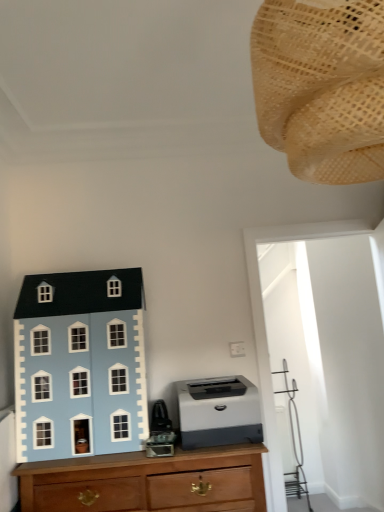
Find the location of `light blue matte dollhouse at left, marked as the 2th toy in a front-to-back arrangement`. light blue matte dollhouse at left, marked as the 2th toy in a front-to-back arrangement is located at coordinates (80, 365).

What is the approximate height of wooden chest of drawers at lower left?

It is 19.79 inches.

Locate an element on the screen. gray matte printer at center is located at coordinates (218, 412).

From a real-world perspective, between woven beige lampshade at upper right, acting as the second toy starting from the left, and gray matte printer at center, who is vertically higher?

In real-world perspective, woven beige lampshade at upper right, acting as the second toy starting from the left, is above.

What's the angular difference between woven beige lampshade at upper right, the second toy positioned from the back, and gray matte printer at center's facing directions?

The angle between the facing direction of woven beige lampshade at upper right, the second toy positioned from the back, and the facing direction of gray matte printer at center is 178 degrees.

Which is correct: woven beige lampshade at upper right, the second toy positioned from the back, is inside gray matte printer at center, or outside of it?

woven beige lampshade at upper right, the second toy positioned from the back, exists outside the volume of gray matte printer at center.

Considering the sizes of objects woven beige lampshade at upper right, which is counted as the first toy, starting from the right, and gray matte printer at center in the image provided, who is taller, woven beige lampshade at upper right, which is counted as the first toy, starting from the right, or gray matte printer at center?

Standing taller between the two is woven beige lampshade at upper right, which is counted as the first toy, starting from the right.

Consider the image. Considering the sizes of gray matte printer at center and wooden chest of drawers at lower left in the image, is gray matte printer at center taller or shorter than wooden chest of drawers at lower left?

gray matte printer at center is shorter than wooden chest of drawers at lower left.

Which object is further away from the camera taking this photo, gray matte printer at center or wooden chest of drawers at lower left?

gray matte printer at center is further from the camera.

Consider the image. From a real-world perspective, which is physically above, gray matte printer at center or wooden chest of drawers at lower left?

gray matte printer at center, from a real-world perspective.

Is gray matte printer at center surrounded by light blue matte dollhouse at left, the second toy when ordered from right to left?

No, gray matte printer at center is not surrounded by light blue matte dollhouse at left, the second toy when ordered from right to left.

Is light blue matte dollhouse at left, the second toy when ordered from right to left, behind gray matte printer at center?

No, the depth of light blue matte dollhouse at left, the second toy when ordered from right to left, is less than that of gray matte printer at center.

Can you confirm if light blue matte dollhouse at left, marked as the 2th toy in a front-to-back arrangement, is smaller than gray matte printer at center?

Incorrect, light blue matte dollhouse at left, marked as the 2th toy in a front-to-back arrangement, is not smaller in size than gray matte printer at center.

From the image's perspective, is light blue matte dollhouse at left, placed as the first toy when sorted from bottom to top, on top of gray matte printer at center?

Yes, from the image's perspective, light blue matte dollhouse at left, placed as the first toy when sorted from bottom to top, is above gray matte printer at center.

How many degrees apart are the facing directions of gray matte printer at center and woven beige lampshade at upper right, the first toy viewed from the top?

178 degrees separate the facing orientations of gray matte printer at center and woven beige lampshade at upper right, the first toy viewed from the top.

From the image's perspective, between gray matte printer at center and woven beige lampshade at upper right, the first toy viewed from the top, who is located below?

gray matte printer at center.

Is gray matte printer at center positioned with its back to woven beige lampshade at upper right, the first toy viewed from the top?

No, woven beige lampshade at upper right, the first toy viewed from the top, is not at the back of gray matte printer at center.

Is gray matte printer at center not inside woven beige lampshade at upper right, the second toy positioned from the back?

Yes, gray matte printer at center is located beyond the bounds of woven beige lampshade at upper right, the second toy positioned from the back.

Who is bigger, light blue matte dollhouse at left, acting as the 1th toy starting from the left, or wooden chest of drawers at lower left?

Bigger between the two is wooden chest of drawers at lower left.

Can you see light blue matte dollhouse at left, which appears as the second toy when viewed from the top, touching wooden chest of drawers at lower left?

No, light blue matte dollhouse at left, which appears as the second toy when viewed from the top, is not beside wooden chest of drawers at lower left.

Looking at this image, who is taller, light blue matte dollhouse at left, which appears as the second toy when viewed from the top, or wooden chest of drawers at lower left?

light blue matte dollhouse at left, which appears as the second toy when viewed from the top.

Is wooden chest of drawers at lower left directly adjacent to gray matte printer at center?

wooden chest of drawers at lower left and gray matte printer at center are clearly separated.

Would you say wooden chest of drawers at lower left is outside gray matte printer at center?

Yes.

Based on the photo, who is smaller, wooden chest of drawers at lower left or gray matte printer at center?

With smaller size is gray matte printer at center.

Could you tell me if wooden chest of drawers at lower left is facing gray matte printer at center?

No.

Is gray matte printer at center not near light blue matte dollhouse at left, which appears as the second toy when viewed from the top?

No, gray matte printer at center is not far from light blue matte dollhouse at left, which appears as the second toy when viewed from the top.

Is gray matte printer at center facing away from light blue matte dollhouse at left, placed as the first toy when sorted from bottom to top?

gray matte printer at center does not have its back to light blue matte dollhouse at left, placed as the first toy when sorted from bottom to top.

Considering the relative positions of gray matte printer at center and light blue matte dollhouse at left, acting as the 1th toy starting from the left, in the image provided, is gray matte printer at center to the left of light blue matte dollhouse at left, acting as the 1th toy starting from the left, from the viewer's perspective?

Incorrect, gray matte printer at center is not on the left side of light blue matte dollhouse at left, acting as the 1th toy starting from the left.

The width and height of the screenshot is (384, 512). In order to click on toy on the left of gray matte printer at center in this screenshot , I will do `click(80, 365)`.

Starting from the gray matte printer at center, which toy is the 2nd one in front? Please provide its 2D coordinates.

[(322, 87)]

Identify the location of chest of drawers below the gray matte printer at center (from the image's perspective). This screenshot has height=512, width=384. (147, 482).

Which object lies further to the anchor point light blue matte dollhouse at left, placed as the first toy when sorted from bottom to top, wooden chest of drawers at lower left or gray matte printer at center?

gray matte printer at center lies further to light blue matte dollhouse at left, placed as the first toy when sorted from bottom to top, than the other object.

From the picture: Looking at the image, which one is located further to wooden chest of drawers at lower left, light blue matte dollhouse at left, marked as the 2th toy in a front-to-back arrangement, or woven beige lampshade at upper right, the second toy positioned from the back?

woven beige lampshade at upper right, the second toy positioned from the back.

From the image, which object appears to be farther from woven beige lampshade at upper right, acting as the second toy starting from the left, light blue matte dollhouse at left, which appears as the second toy when viewed from the top, or gray matte printer at center?

light blue matte dollhouse at left, which appears as the second toy when viewed from the top, lies further to woven beige lampshade at upper right, acting as the second toy starting from the left, than the other object.

Which object lies further to the anchor point gray matte printer at center, wooden chest of drawers at lower left or woven beige lampshade at upper right, acting as the second toy starting from the left?

woven beige lampshade at upper right, acting as the second toy starting from the left, lies further to gray matte printer at center than the other object.

Based on their spatial positions, is gray matte printer at center or light blue matte dollhouse at left, marked as the 2th toy in a front-to-back arrangement, further from wooden chest of drawers at lower left?

light blue matte dollhouse at left, marked as the 2th toy in a front-to-back arrangement, is positioned further to the anchor wooden chest of drawers at lower left.

Looking at this image, from the image, which object appears to be farther from light blue matte dollhouse at left, the second toy when ordered from right to left, woven beige lampshade at upper right, the first toy positioned from the front, or wooden chest of drawers at lower left?

woven beige lampshade at upper right, the first toy positioned from the front, lies further to light blue matte dollhouse at left, the second toy when ordered from right to left, than the other object.

Looking at the image, which one is located closer to woven beige lampshade at upper right, acting as the second toy starting from the left, gray matte printer at center or wooden chest of drawers at lower left?

gray matte printer at center is closer to woven beige lampshade at upper right, acting as the second toy starting from the left.

Looking at the image, which one is located closer to wooden chest of drawers at lower left, light blue matte dollhouse at left, acting as the 1th toy starting from the left, or gray matte printer at center?

gray matte printer at center lies closer to wooden chest of drawers at lower left than the other object.

This screenshot has width=384, height=512. Identify the location of toy between woven beige lampshade at upper right, the first toy viewed from the top, and gray matte printer at center in the up-down direction. (80, 365).

Locate an element on the screen. This screenshot has width=384, height=512. printer between light blue matte dollhouse at left, acting as the 1th toy starting from the left, and wooden chest of drawers at lower left, in the vertical direction is located at coordinates (218, 412).

At what (x,y) coordinates should I click in order to perform the action: click on printer between woven beige lampshade at upper right, which is counted as the first toy, starting from the right, and wooden chest of drawers at lower left, in the vertical direction. Please return your answer as a coordinate pair (x, y). Image resolution: width=384 pixels, height=512 pixels. Looking at the image, I should click on (218, 412).

I want to click on toy that lies between woven beige lampshade at upper right, the first toy viewed from the top, and wooden chest of drawers at lower left from top to bottom, so click(80, 365).